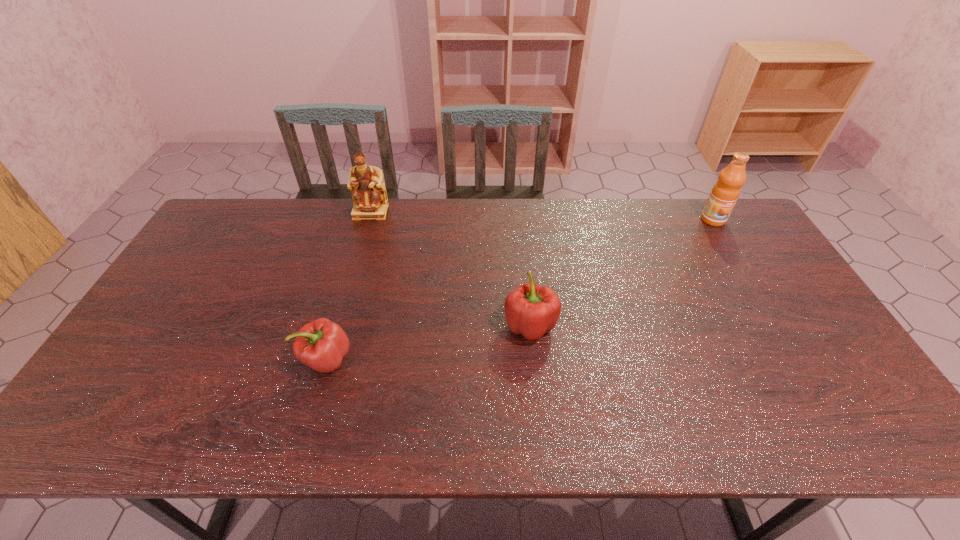
Where is `the rightmost object`? the rightmost object is located at coordinates (725, 192).

This screenshot has height=540, width=960. Find the location of `figurine`. figurine is located at coordinates (x=368, y=191).

Where is `the second object from right to left`? The height and width of the screenshot is (540, 960). the second object from right to left is located at coordinates (531, 310).

Locate an element on the screen. The image size is (960, 540). the left bell pepper is located at coordinates click(321, 344).

The height and width of the screenshot is (540, 960). What are the coordinates of `free space located on the label side of the rightmost object` in the screenshot? It's located at (750, 280).

Identify the location of free space located 0.340m on the front-facing side of the figurine. (348, 292).

The height and width of the screenshot is (540, 960). I want to click on free location located on the front of the second object from right to left, so click(x=539, y=408).

The width and height of the screenshot is (960, 540). Identify the location of vacant space located on the back of the left bell pepper. (355, 262).

Identify the location of fruit juice situated at the far edge. The width and height of the screenshot is (960, 540). (725, 192).

This screenshot has height=540, width=960. I want to click on figurine located at the far edge, so click(x=368, y=191).